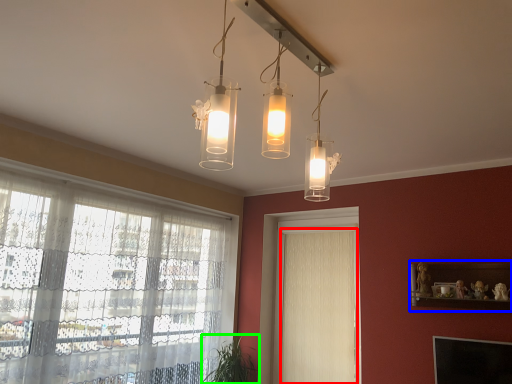
Question: Which is farther away from curtain (highlighted by a red box)? shelf (highlighted by a blue box) or plant (highlighted by a green box)?

Choices:
 (A) shelf
 (B) plant

Answer: (A)